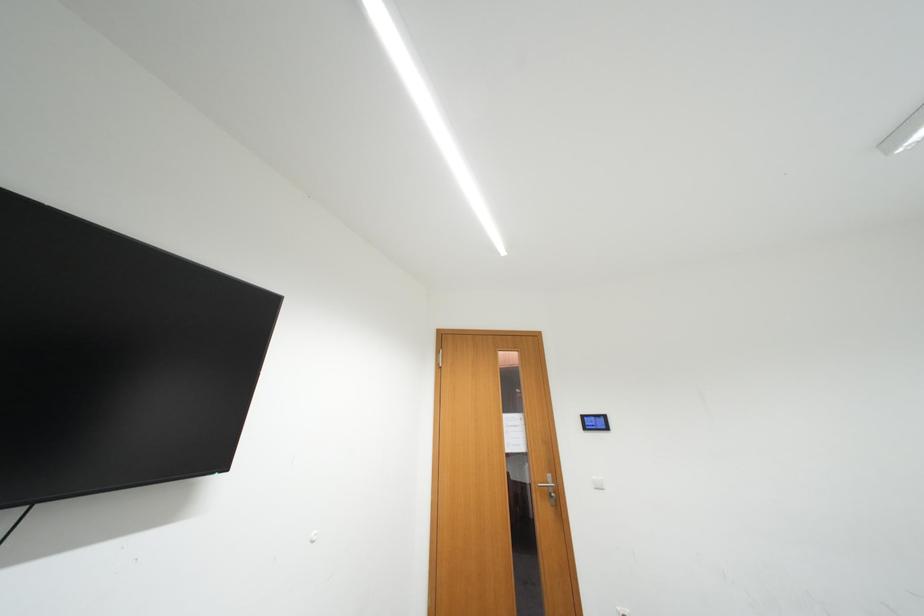
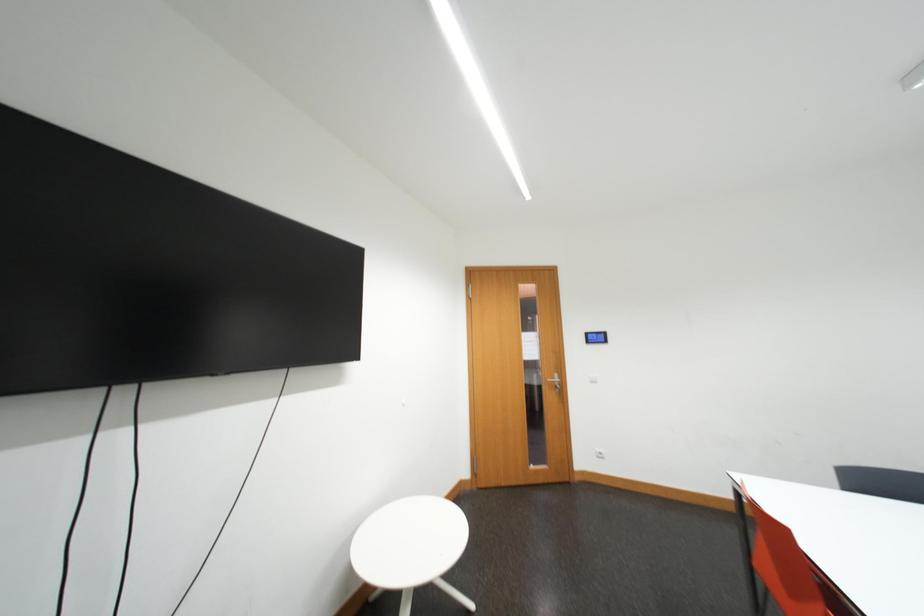
Based on the photo, the images are taken continuously from a first-person perspective. In which direction are you moving?

The movement direction of the cameraman is left, backward.